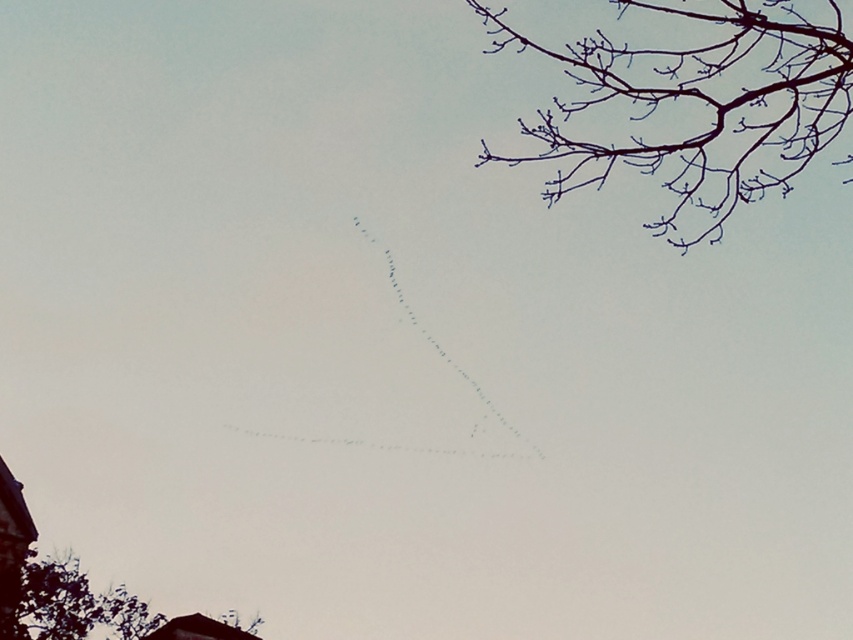
Is the position of brown/dry branches at upper right less distant than that of green leafy tree at lower left?

Yes, it is.

Looking at this image, is brown/dry branches at upper right to the left of green leafy tree at lower left from the viewer's perspective?

No, brown/dry branches at upper right is not to the left of green leafy tree at lower left.

Locate an element on the screen. The height and width of the screenshot is (640, 853). brown/dry branches at upper right is located at coordinates (700, 102).